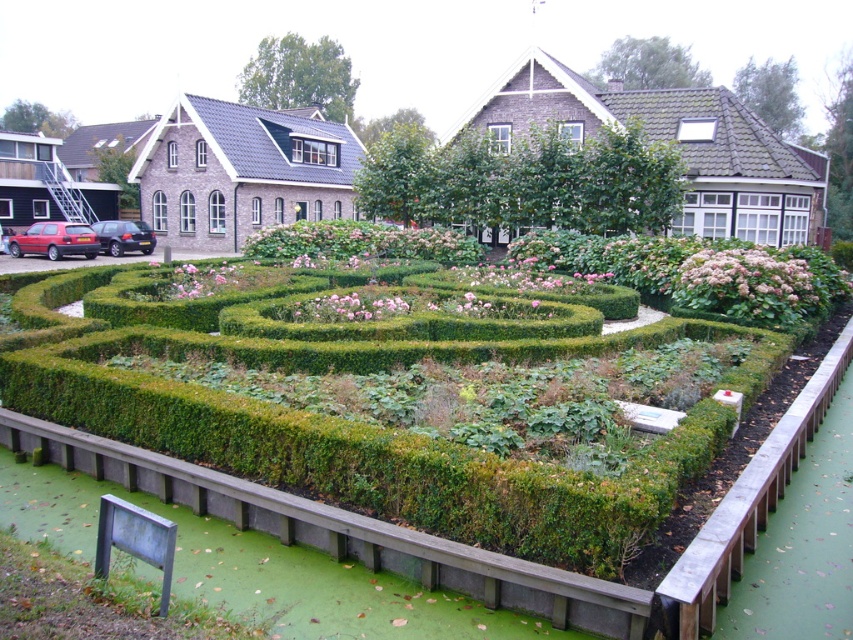
Question: Which of the following is the farthest from the observer?

Choices:
 (A) green leafy hedge at center
 (B) green hedge maze at center

Answer: (A)

Question: Which of the following is the farthest from the observer?

Choices:
 (A) (186, 349)
 (B) (631, 129)

Answer: (B)

Question: Is green hedge maze at center behind green leafy hedge at center?

Choices:
 (A) no
 (B) yes

Answer: (A)

Question: Does green hedge maze at center have a lesser width compared to green leafy hedge at center?

Choices:
 (A) yes
 (B) no

Answer: (A)

Question: Can you confirm if green hedge maze at center is positioned to the right of green leafy hedge at center?

Choices:
 (A) no
 (B) yes

Answer: (B)